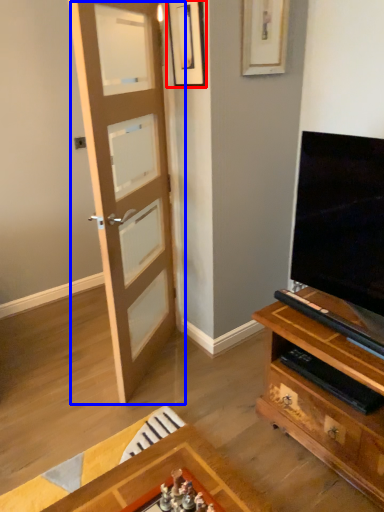
Question: Which of the following is the closest to the observer, picture frame (highlighted by a red box) or door (highlighted by a blue box)?

Choices:
 (A) picture frame
 (B) door

Answer: (B)